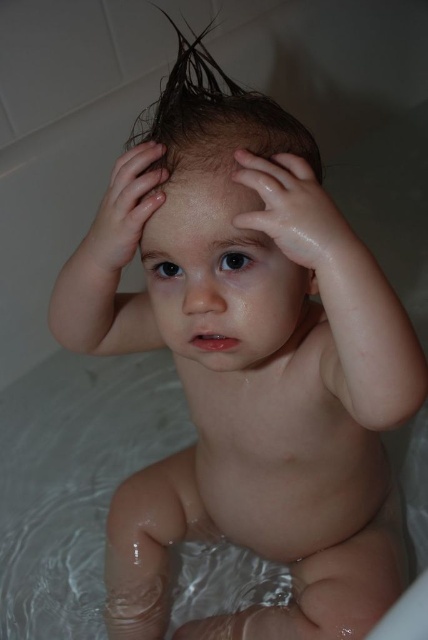
Between point (259, 150) and point (297, 220), which one is positioned behind?

Positioned behind is point (259, 150).

Which is more to the left, wet brown hair at upper center or glossy wet hand at center?

wet brown hair at upper center is more to the left.

Does point (211, 138) come farther from viewer compared to point (324, 257)?

Yes, it is behind point (324, 257).

Image resolution: width=428 pixels, height=640 pixels. Identify the location of wet brown hair at upper center. (216, 115).

Between point (306, 134) and point (151, 147), which one is positioned in front?

Point (151, 147)

Who is positioned more to the right, wet brown hair at upper center or glossy skin hand at upper center?

wet brown hair at upper center is more to the right.

Where is `wet brown hair at upper center`? wet brown hair at upper center is located at coordinates (216, 115).

Who is more forward, [345,234] or [128,216]?

Point [345,234] is more forward.

Is the position of glossy wet hand at center less distant than that of glossy skin hand at upper center?

Yes, it is in front of glossy skin hand at upper center.

This screenshot has height=640, width=428. What do you see at coordinates (297, 216) in the screenshot?
I see `glossy wet hand at center` at bounding box center [297, 216].

Where is `glossy wet hand at center`? glossy wet hand at center is located at coordinates (297, 216).